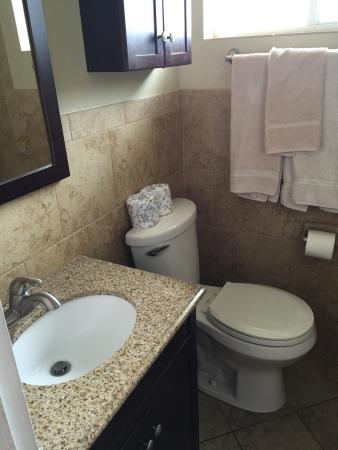
Find the location of a particular element. drawers is located at coordinates (175, 408).